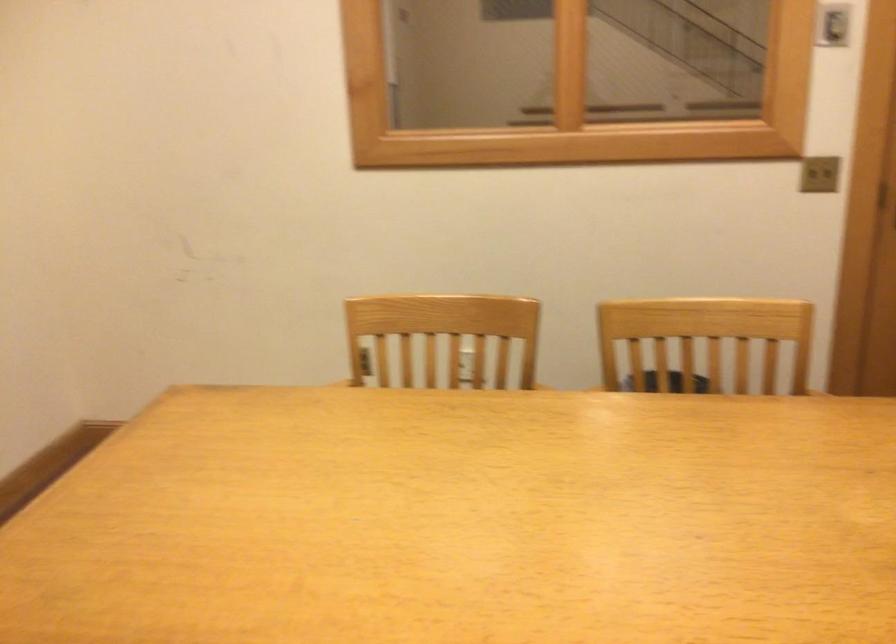
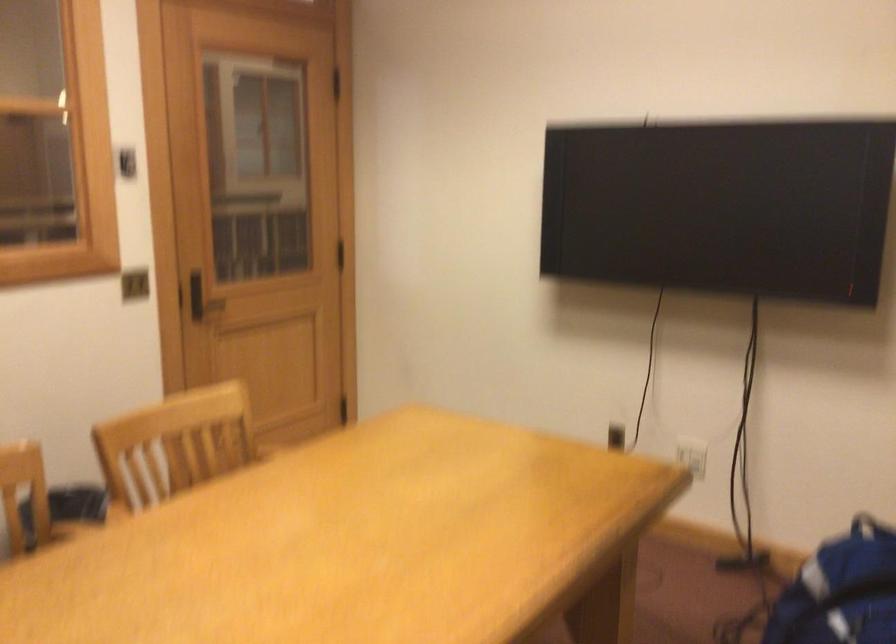
Question: The camera is either moving clockwise (left) or counter-clockwise (right) around the object. The first image is from the beginning of the video and the second image is from the end. Is the camera moving left or right when shooting the video?

Choices:
 (A) Left
 (B) Right

Answer: (A)